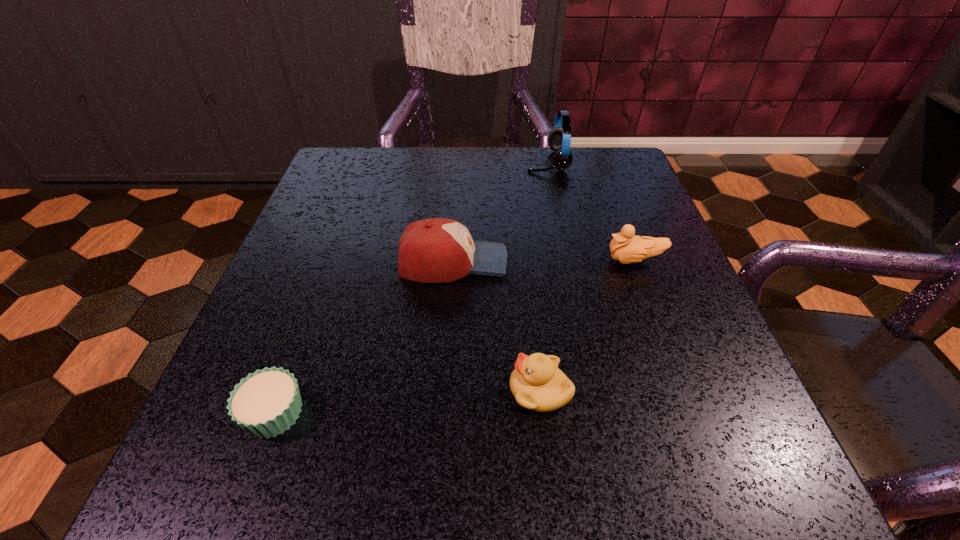
In order to click on vacant space situated with the microphone attached to the side of the headset in this screenshot , I will do pyautogui.click(x=480, y=161).

Find the location of a particular element. free region located on the front-facing side of the baseball cap is located at coordinates (623, 262).

The image size is (960, 540). I want to click on vacant area situated 0.310m on the face of the right duckling, so click(435, 261).

At what (x,y) coordinates should I click in order to perform the action: click on free region located 0.370m on the face of the right duckling. Please return your answer as a coordinate pair (x, y). Image resolution: width=960 pixels, height=540 pixels. Looking at the image, I should click on (402, 261).

Identify the location of vacant region located on the face of the right duckling. (441, 261).

Where is `vacant space located on the front-facing side of the nearer duckling`? vacant space located on the front-facing side of the nearer duckling is located at coordinates (379, 390).

The height and width of the screenshot is (540, 960). Find the location of `vacant position located on the front-facing side of the nearer duckling`. vacant position located on the front-facing side of the nearer duckling is located at coordinates (401, 390).

You are a GUI agent. You are given a task and a screenshot of the screen. Output one action in this format:
    pyautogui.click(x=<x>, y=<y>)
    Task: Click on the vacant region located 0.220m on the front-facing side of the nearer duckling
    This screenshot has width=960, height=540.
    Given the screenshot: What is the action you would take?
    pyautogui.click(x=350, y=390)

The width and height of the screenshot is (960, 540). I want to click on vacant space located 0.310m on the back of the cupcake, so click(336, 243).

Where is `object located in the far edge section of the desktop`? The image size is (960, 540). object located in the far edge section of the desktop is located at coordinates (559, 140).